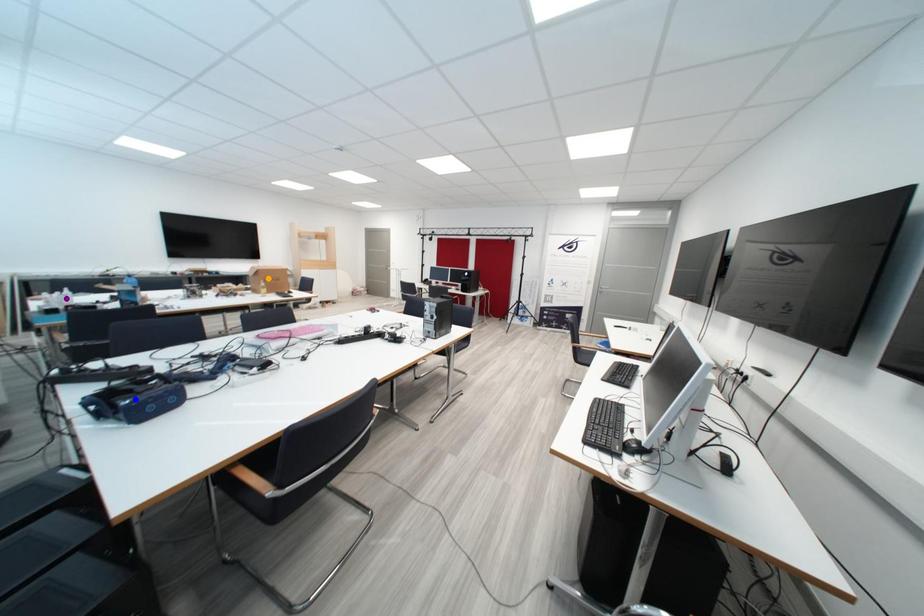
Order these from nearest to farthest:
A) purple point
B) blue point
C) orange point

blue point, purple point, orange point